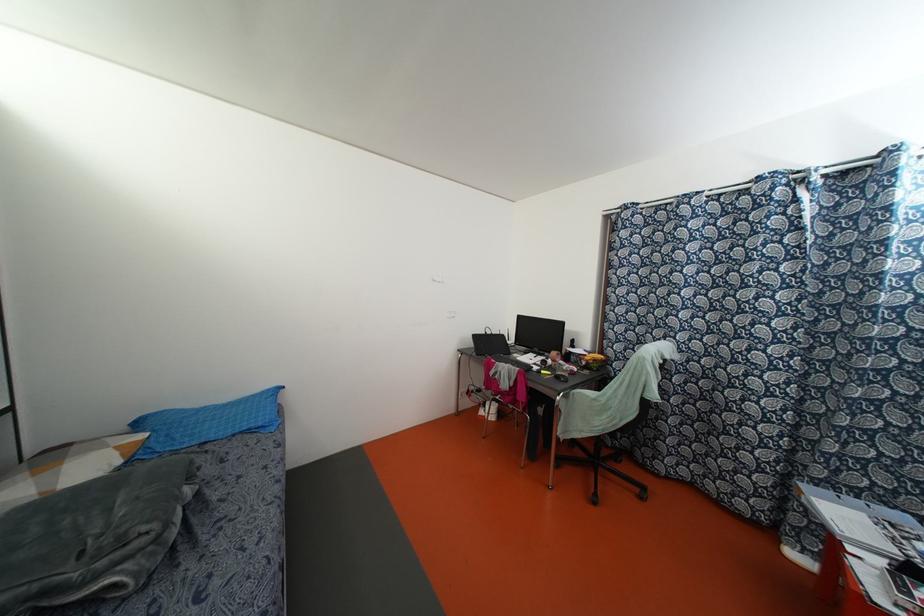
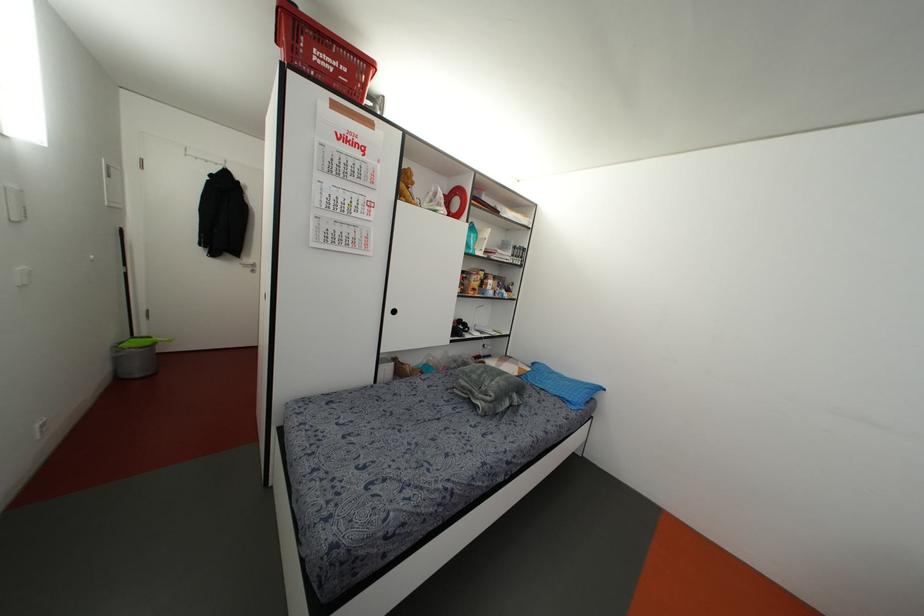
Locate, in the second image, the point that corresponds to (259,424) in the first image.

(569, 399)